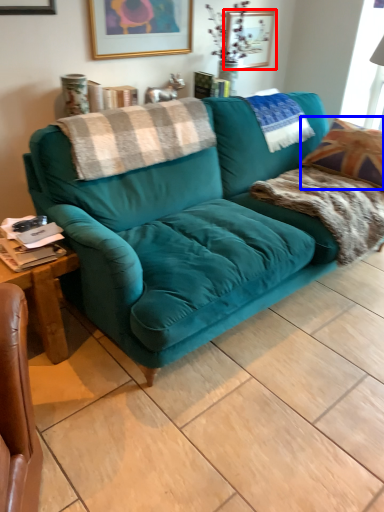
Question: Which object is further to the camera taking this photo, picture frame (highlighted by a red box) or throw pillow (highlighted by a blue box)?

Choices:
 (A) picture frame
 (B) throw pillow

Answer: (A)